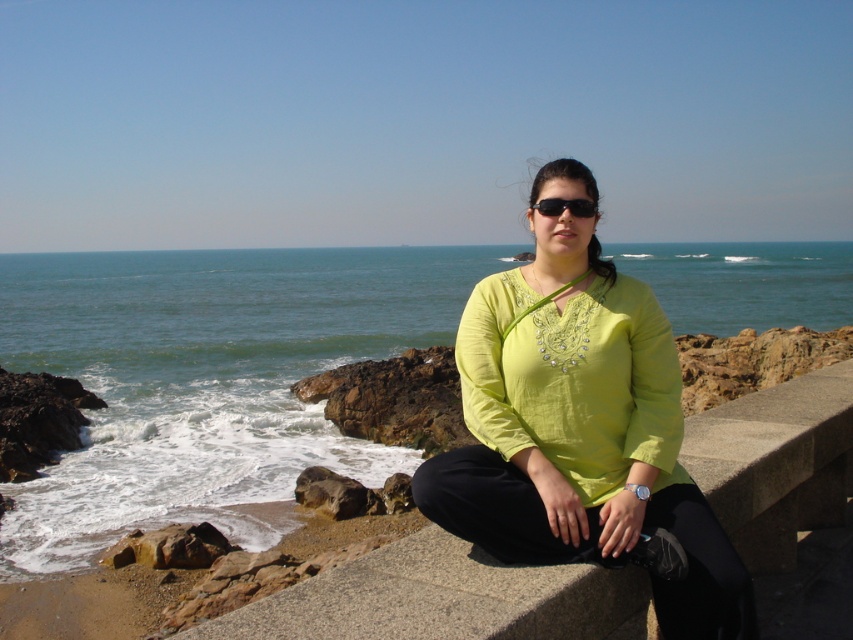
You are a photographer planning to capture the scene with the woman sitting on the concrete ledge. You want to ensure that both the blue water at center and the lime green fabric at center are visible in your shot. Based on their positions, which object should be placed higher in the frame to include both?

The blue water at center is above the lime green fabric at center, so to include both in the shot, the photographer should position the frame so the blue water at center is higher up while still capturing the lime green fabric at center below it.

You are taking a photo of the coastal scene. You want to focus on the point closer to the camera between the two points, point (218, 262) and point (593, 202). Which point should you focus on?

You should focus on point (218, 262) because it is further to the camera than point (593, 202).